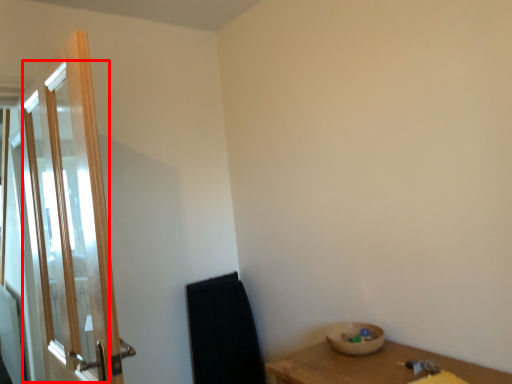
Question: From the image's perspective, considering the relative positions of screen door (annotated by the red box) and basin in the image provided, where is screen door (annotated by the red box) located with respect to the staircase?

Choices:
 (A) above
 (B) below

Answer: (A)